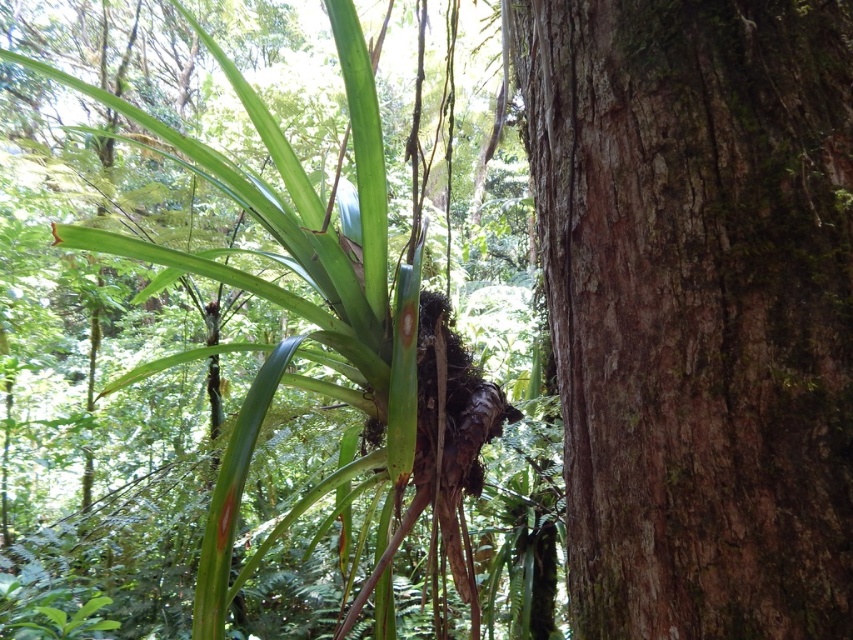
You are a hiker trying to navigate through the forest. You see the brown rough bark at right and the green rough bark tree at center. If you want to walk between them, will you have enough space to pass through?

The brown rough bark at right is 42.57 centimeters away from the green rough bark tree at center. Since the distance between them is only about 42.57 centimeters, it would be very tight for a person to pass through comfortably. You might need to squeeze or find another path.

You are a hiker who wants to climb the tallest tree in the forest. You see the brown rough bark at right and the green rough bark tree at center. Which one should you choose to climb?

The green rough bark tree at center is taller than the brown rough bark at right, so you should choose the green rough bark tree at center to climb.